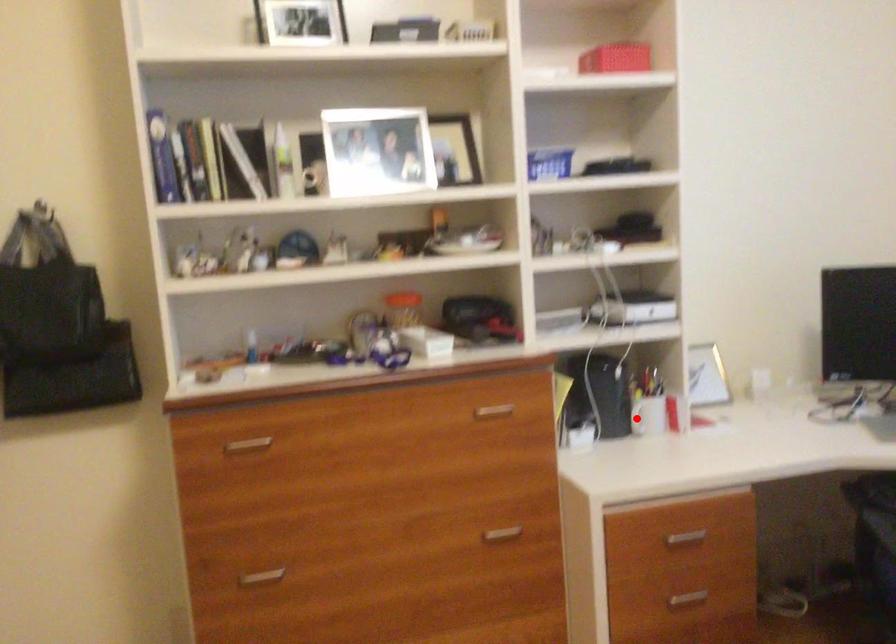
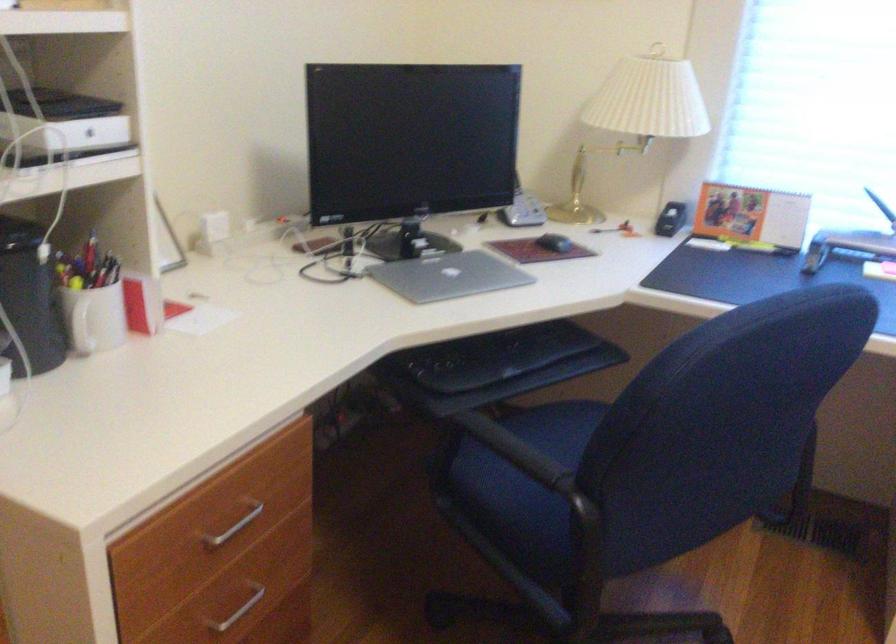
Locate, in the second image, the point that corresponds to the highlighted location in the first image.

(82, 328)